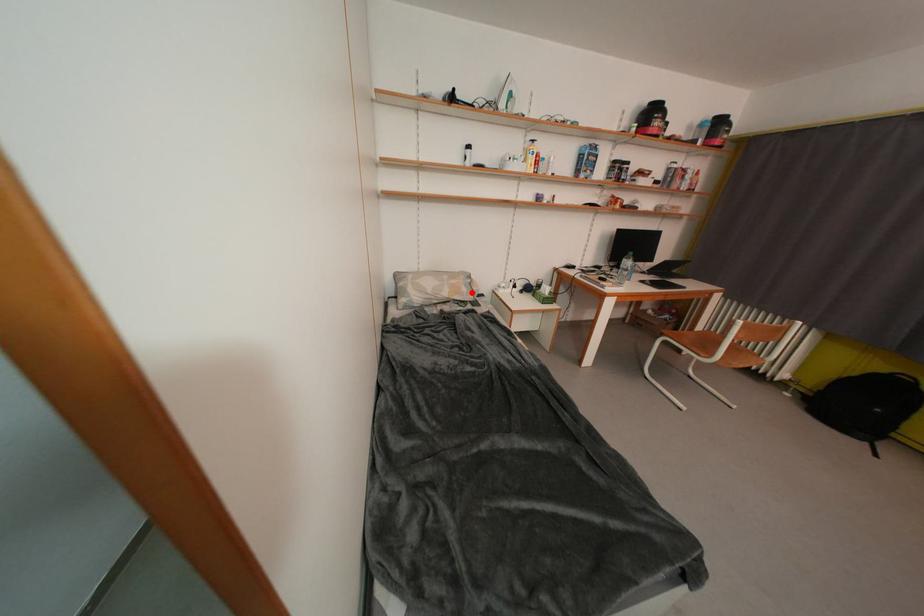
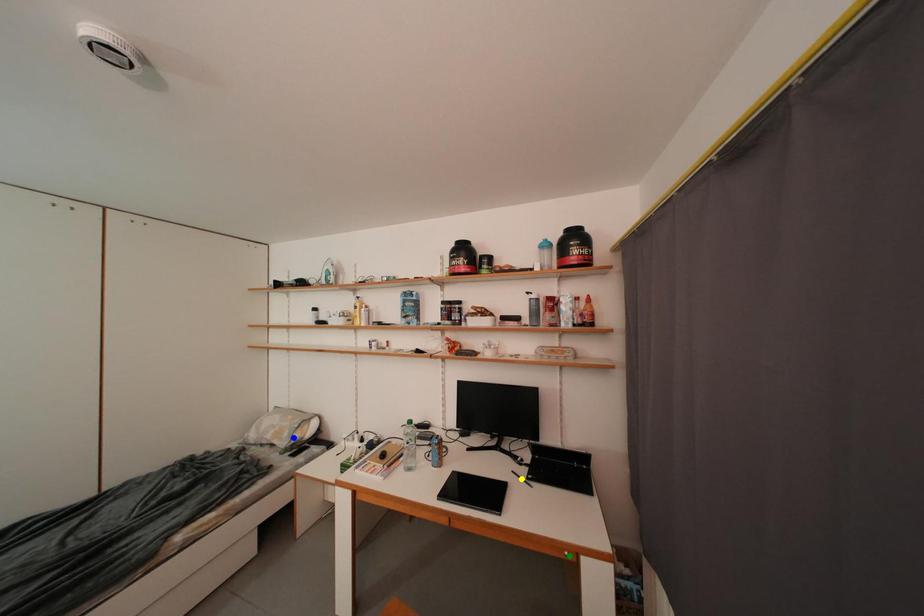
Question: I am providing you with two images of the same scene from different viewpoints. A red point is marked on the first image. You are given multiple points on the second image. In image 2, which mark is for the same physical point as the one in image 1?

Choices:
 (A) blue point
 (B) green point
 (C) yellow point

Answer: (A)